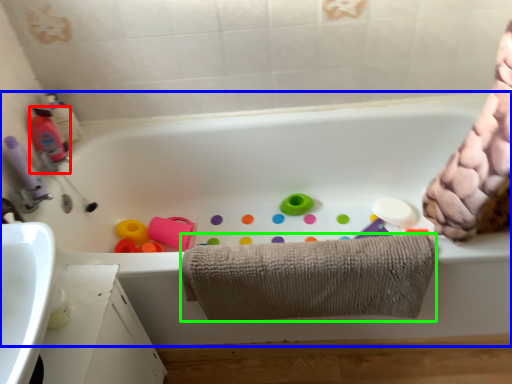
Question: Which is farther away from cleaning product (highlighted by a red box)? bathtub (highlighted by a blue box) or towel (highlighted by a green box)?

Choices:
 (A) bathtub
 (B) towel

Answer: (B)